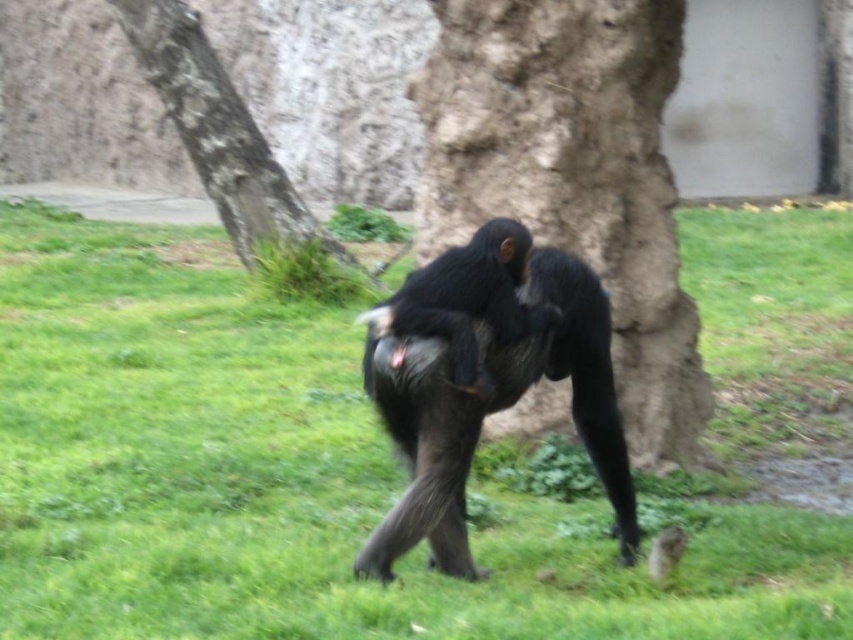
Is shiny black monkey at center further to camera compared to rough bark tree at upper left?

No, shiny black monkey at center is closer to the viewer.

Between shiny black monkey at center and rough bark tree at upper left, which one appears on the right side from the viewer's perspective?

Positioned to the right is shiny black monkey at center.

Measure the distance between point [599,314] and camera.

The distance of point [599,314] from camera is 3.94 meters.

Identify the location of shiny black monkey at center. This screenshot has width=853, height=640. (492, 412).

Is green grassy at center to the left of shiny black monkey at center from the viewer's perspective?

Correct, you'll find green grassy at center to the left of shiny black monkey at center.

Can you confirm if green grassy at center is wider than shiny black monkey at center?

Yes.

Where is `green grassy at center`? The height and width of the screenshot is (640, 853). green grassy at center is located at coordinates (305, 477).

Does rough bark tree trunk at center appear on the right side of rough bark tree at upper left?

Correct, you'll find rough bark tree trunk at center to the right of rough bark tree at upper left.

This screenshot has height=640, width=853. I want to click on rough bark tree trunk at center, so click(573, 177).